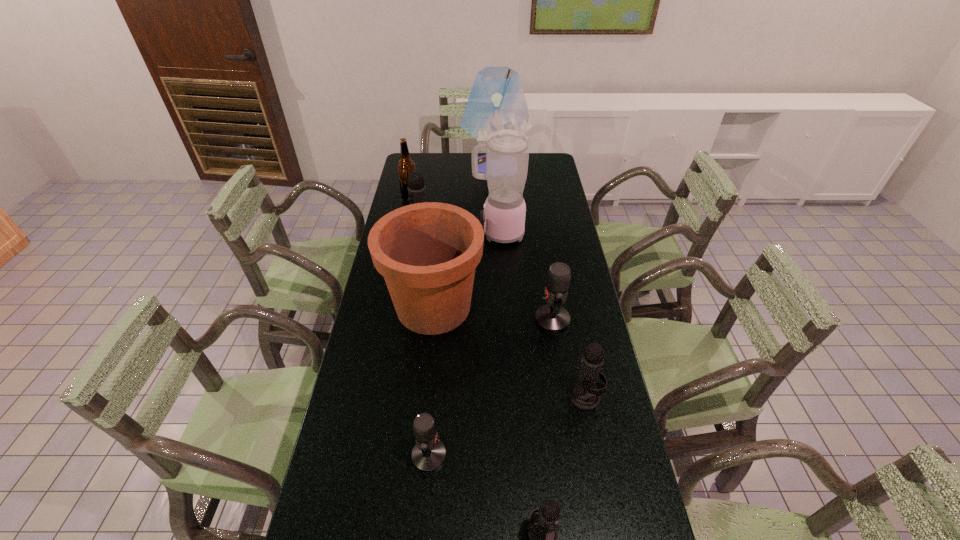
This screenshot has height=540, width=960. I want to click on free space located 0.360m on the label of the eighth nearest object, so click(500, 199).

Locate an element on the screen. The height and width of the screenshot is (540, 960). vacant area situated on the front of the leftmost microphone is located at coordinates (410, 301).

Locate an element on the screen. The width and height of the screenshot is (960, 540). free space located 0.300m on the side of the farther red microphone with the red ring is located at coordinates (442, 319).

This screenshot has height=540, width=960. In order to click on vacant space located 0.230m on the side of the farther red microphone with the red ring in this screenshot , I will do `click(464, 319)`.

You are a GUI agent. You are given a task and a screenshot of the screen. Output one action in this format:
    pyautogui.click(x=<x>, y=<y>)
    Task: Click on the free location located 0.340m on the side of the farther red microphone with the red ring
    Image resolution: width=960 pixels, height=540 pixels.
    Given the screenshot: What is the action you would take?
    pyautogui.click(x=429, y=319)

I want to click on vacant space situated on the left of the second smallest black microphone, so click(x=511, y=396).

In order to click on vacant region located on the side of the smaller red microphone with the red ring in this screenshot , I will do click(x=595, y=455).

Image resolution: width=960 pixels, height=540 pixels. Find the location of `object that is at the far edge`. object that is at the far edge is located at coordinates (496, 102).

The height and width of the screenshot is (540, 960). Identify the location of flowerpot that is at the left edge. (427, 252).

Locate an element on the screen. beer bottle located in the left edge section of the desktop is located at coordinates (406, 166).